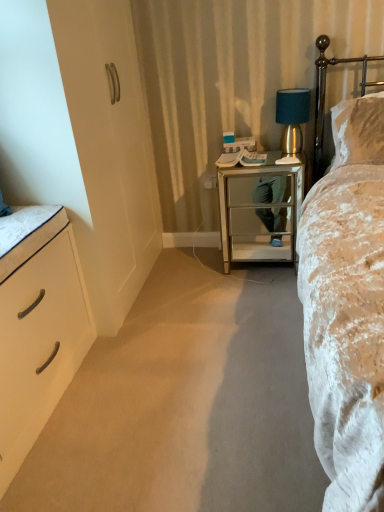
Question: From a real-world perspective, is gold metallic headboard at upper right located higher than white matte chest of drawers at left?

Choices:
 (A) no
 (B) yes

Answer: (B)

Question: Considering the relative positions of gold metallic headboard at upper right and white matte chest of drawers at left in the image provided, is gold metallic headboard at upper right behind white matte chest of drawers at left?

Choices:
 (A) yes
 (B) no

Answer: (A)

Question: Can you confirm if gold metallic headboard at upper right is smaller than white matte chest of drawers at left?

Choices:
 (A) yes
 (B) no

Answer: (A)

Question: Is gold metallic headboard at upper right in front of white matte chest of drawers at left?

Choices:
 (A) yes
 (B) no

Answer: (B)

Question: Is gold metallic headboard at upper right oriented towards white matte chest of drawers at left?

Choices:
 (A) no
 (B) yes

Answer: (A)

Question: In terms of size, does white matte chest of drawers at left appear bigger or smaller than teal fabric lampshade at right?

Choices:
 (A) big
 (B) small

Answer: (A)

Question: From a real-world perspective, is white matte chest of drawers at left physically located above or below teal fabric lampshade at right?

Choices:
 (A) above
 (B) below

Answer: (B)

Question: Is white matte chest of drawers at left inside or outside of teal fabric lampshade at right?

Choices:
 (A) inside
 (B) outside

Answer: (B)

Question: Is white matte chest of drawers at left in front of or behind teal fabric lampshade at right in the image?

Choices:
 (A) front
 (B) behind

Answer: (A)

Question: In the image, is velvet beige bed at right on the left side or the right side of gold metallic headboard at upper right?

Choices:
 (A) right
 (B) left

Answer: (B)

Question: From a real-world perspective, relative to gold metallic headboard at upper right, is velvet beige bed at right vertically above or below?

Choices:
 (A) below
 (B) above

Answer: (A)

Question: In terms of height, does velvet beige bed at right look taller or shorter compared to gold metallic headboard at upper right?

Choices:
 (A) short
 (B) tall

Answer: (B)

Question: Considering the positions of velvet beige bed at right and gold metallic headboard at upper right in the image, is velvet beige bed at right wider or thinner than gold metallic headboard at upper right?

Choices:
 (A) wide
 (B) thin

Answer: (A)

Question: Which is correct: teal fabric lampshade at right is inside white matte chest of drawers at left, or outside of it?

Choices:
 (A) outside
 (B) inside

Answer: (A)

Question: From their relative heights in the image, would you say teal fabric lampshade at right is taller or shorter than white matte chest of drawers at left?

Choices:
 (A) tall
 (B) short

Answer: (B)